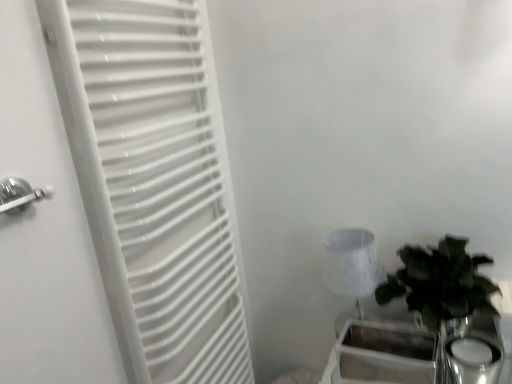
Question: Considering the relative positions of white matte radiator at left and metallic silver tray at lower right in the image provided, is white matte radiator at left to the left of metallic silver tray at lower right from the viewer's perspective?

Choices:
 (A) yes
 (B) no

Answer: (A)

Question: Could you tell me if white matte radiator at left is turned towards metallic silver tray at lower right?

Choices:
 (A) yes
 (B) no

Answer: (A)

Question: Is white matte radiator at left thinner than metallic silver tray at lower right?

Choices:
 (A) no
 (B) yes

Answer: (A)

Question: From the image's perspective, is white matte radiator at left beneath metallic silver tray at lower right?

Choices:
 (A) yes
 (B) no

Answer: (B)

Question: Does white matte radiator at left lie in front of metallic silver tray at lower right?

Choices:
 (A) yes
 (B) no

Answer: (A)

Question: From their relative heights in the image, would you say white fabric lampshade at right is taller or shorter than white matte radiator at left?

Choices:
 (A) tall
 (B) short

Answer: (B)

Question: From a real-world perspective, is white fabric lampshade at right above or below white matte radiator at left?

Choices:
 (A) above
 (B) below

Answer: (B)

Question: Which is correct: white fabric lampshade at right is inside white matte radiator at left, or outside of it?

Choices:
 (A) outside
 (B) inside

Answer: (A)

Question: Relative to white matte radiator at left, is white fabric lampshade at right in front or behind?

Choices:
 (A) front
 (B) behind

Answer: (B)

Question: Is white fabric lampshade at right bigger or smaller than green leafy plant in glass vase at right?

Choices:
 (A) small
 (B) big

Answer: (A)

Question: From the image's perspective, is white fabric lampshade at right located above or below green leafy plant in glass vase at right?

Choices:
 (A) below
 (B) above

Answer: (B)

Question: Would you say white fabric lampshade at right is inside or outside green leafy plant in glass vase at right?

Choices:
 (A) outside
 (B) inside

Answer: (A)

Question: Is white fabric lampshade at right in front of or behind green leafy plant in glass vase at right in the image?

Choices:
 (A) behind
 (B) front

Answer: (A)

Question: In the image, is white fabric lampshade at right positioned in front of or behind metallic silver tray at lower right?

Choices:
 (A) front
 (B) behind

Answer: (B)

Question: Is white fabric lampshade at right wider or thinner than metallic silver tray at lower right?

Choices:
 (A) thin
 (B) wide

Answer: (B)